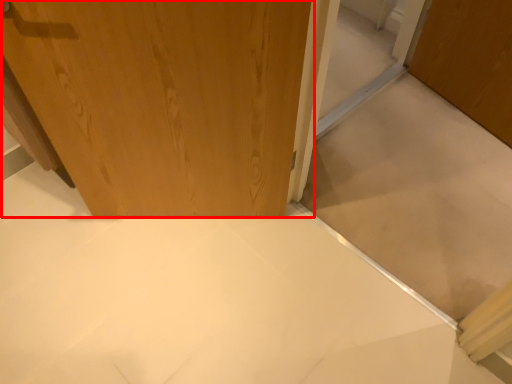
Question: From the image's perspective, where is door (annotated by the red box) located in relation to cabinetry in the image?

Choices:
 (A) above
 (B) below

Answer: (A)